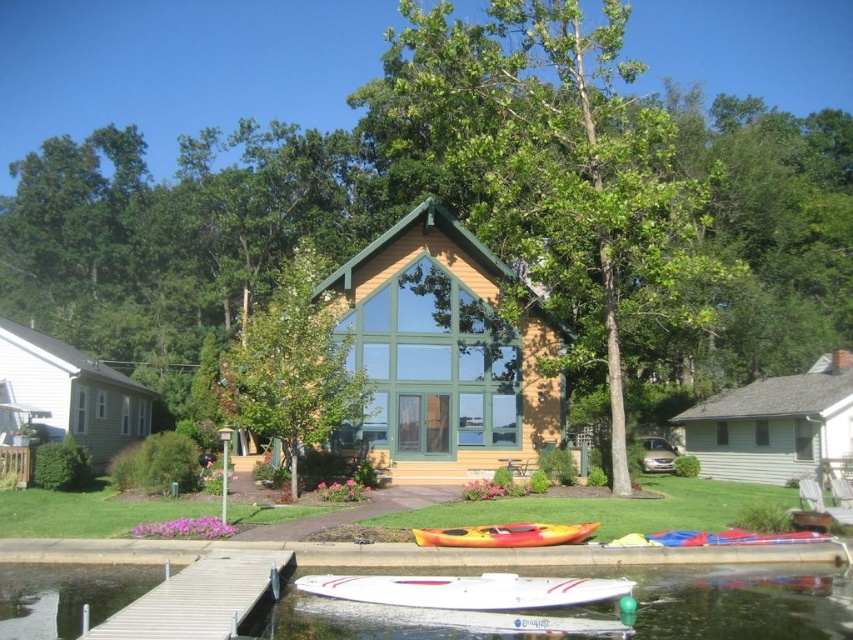
Which is above, wooden cabin at center or white siding cabin at left?

wooden cabin at center is above.

Does wooden cabin at center have a lesser height compared to white siding cabin at left?

No, wooden cabin at center is not shorter than white siding cabin at left.

This screenshot has height=640, width=853. What do you see at coordinates (445, 353) in the screenshot? I see `wooden cabin at center` at bounding box center [445, 353].

At what (x,y) coordinates should I click in order to perform the action: click on wooden cabin at center. Please return your answer as a coordinate pair (x, y). Looking at the image, I should click on (445, 353).

Which is behind, point (469, 356) or point (498, 541)?

Positioned behind is point (469, 356).

Where is `wooden cabin at center`? wooden cabin at center is located at coordinates (445, 353).

Does wooden cabin at center appear on the right side of white wood dock at lower left?

Correct, you'll find wooden cabin at center to the right of white wood dock at lower left.

What do you see at coordinates (445, 353) in the screenshot? Image resolution: width=853 pixels, height=640 pixels. I see `wooden cabin at center` at bounding box center [445, 353].

This screenshot has width=853, height=640. What are the coordinates of `wooden cabin at center` in the screenshot? It's located at (445, 353).